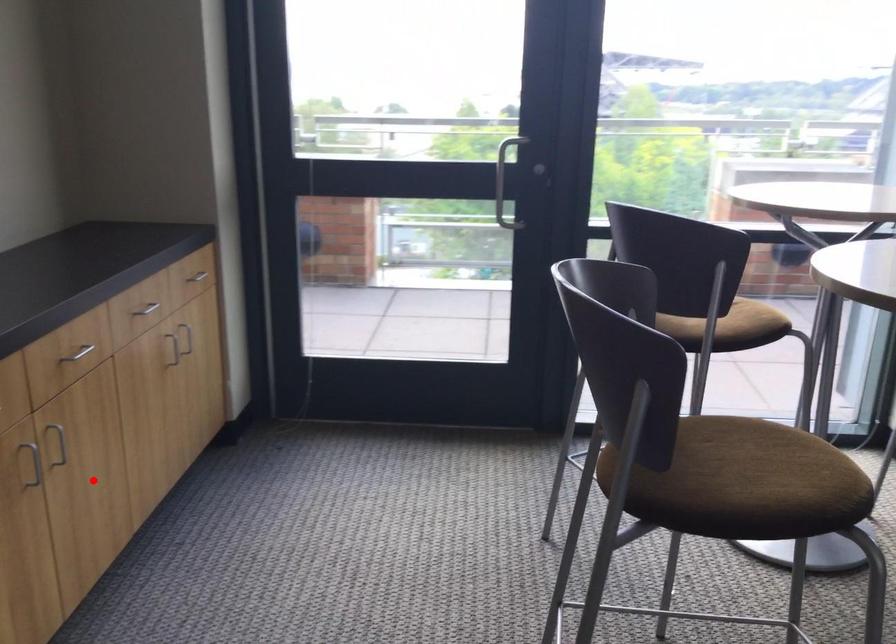
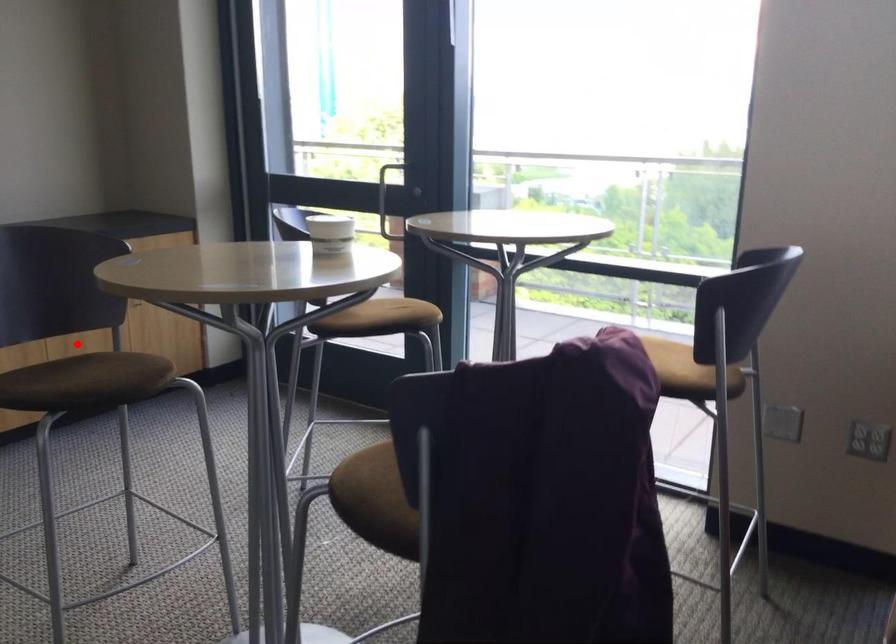
I am providing you with two images of the same scene from different viewpoints. A red point is marked on the first image and another point is marked on the second image. Is the red point in image1 aligned with the point shown in image2?

Yes